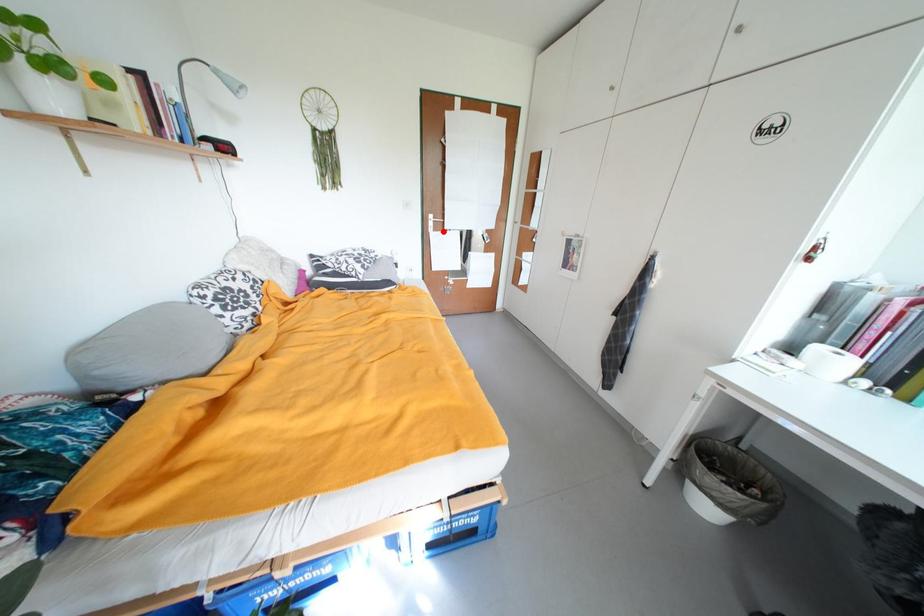
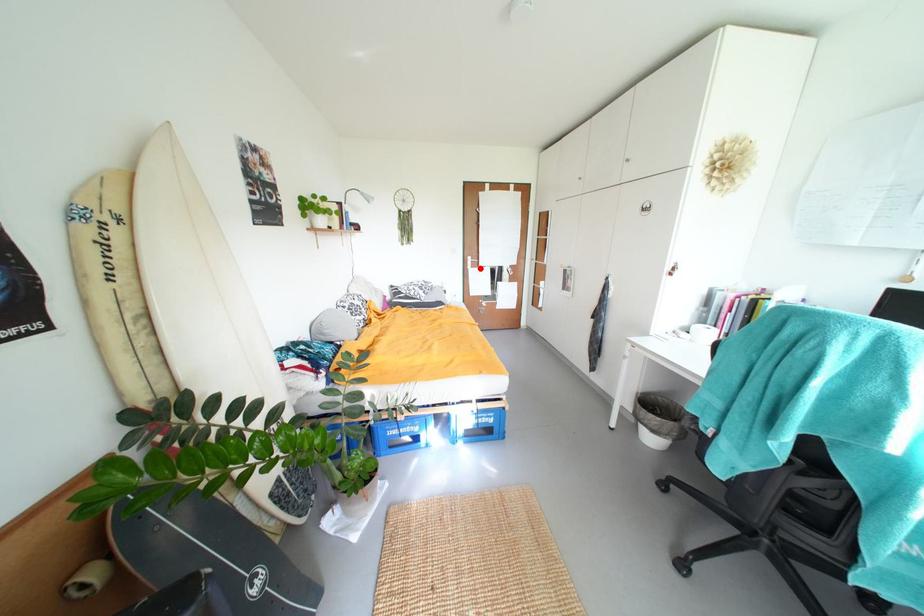
I am providing you with two images of the same scene from different viewpoints. A red point is marked on the first image and another point is marked on the second image. Are the points marked in image1 and image2 representing the same 3D position?

Yes